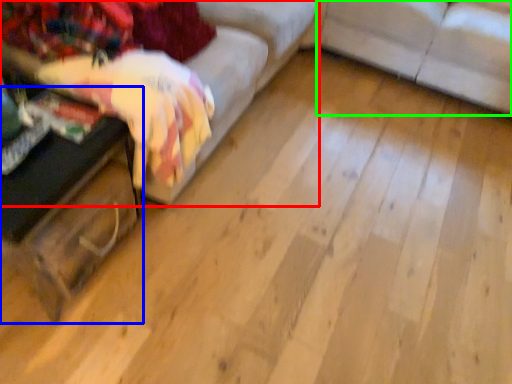
Question: Which is farther away from studio couch (highlighted by a red box)? table (highlighted by a blue box) or studio couch (highlighted by a green box)?

Choices:
 (A) table
 (B) studio couch

Answer: (B)